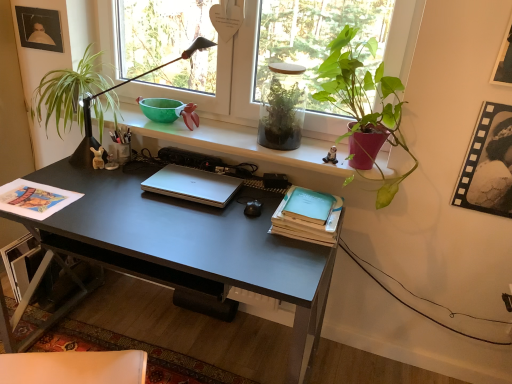
This screenshot has width=512, height=384. I want to click on free spot above silver metallic laptop at center (from a real-world perspective), so (x=195, y=187).